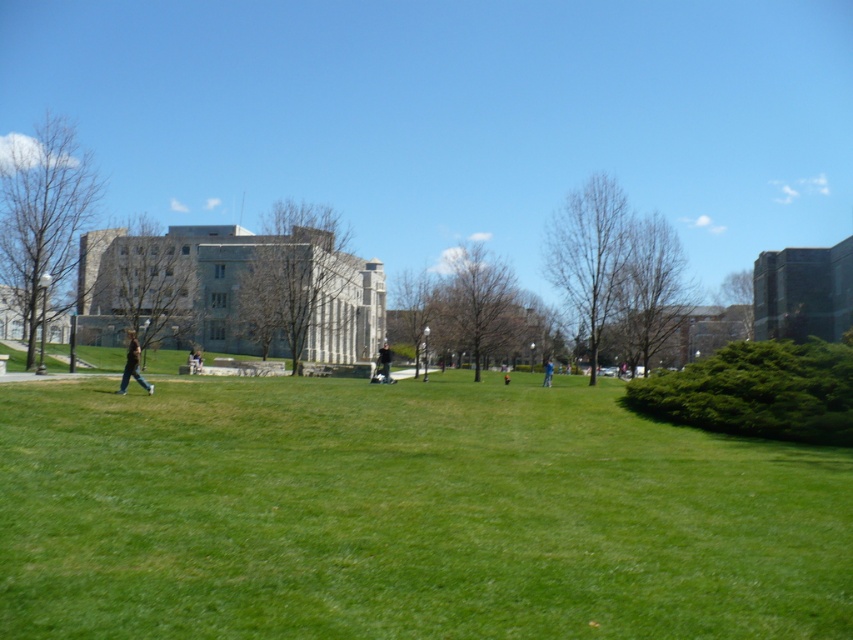
How distant is dark blue jeans at center from light brown leather jacket at center?

dark blue jeans at center is 12.06 meters from light brown leather jacket at center.

Does dark blue jeans at center have a larger size compared to light brown leather jacket at center?

Indeed, dark blue jeans at center has a larger size compared to light brown leather jacket at center.

Locate an element on the screen. This screenshot has height=640, width=853. dark blue jeans at center is located at coordinates (384, 360).

Locate an element on the screen. This screenshot has height=640, width=853. dark blue jeans at center is located at coordinates (384, 360).

Is dark blue jeans at center closer to camera compared to blue fabric person at center?

Yes, dark blue jeans at center is closer to the viewer.

Can you confirm if dark blue jeans at center is positioned to the right of blue fabric person at center?

No, dark blue jeans at center is not to the right of blue fabric person at center.

The image size is (853, 640). Describe the element at coordinates (384, 360) in the screenshot. I see `dark blue jeans at center` at that location.

Locate an element on the screen. dark blue jeans at center is located at coordinates (384, 360).

Does light brown leather jacket at left have a greater width compared to light brown leather jacket at center?

No.

Which is below, light brown leather jacket at left or light brown leather jacket at center?

Positioned lower is light brown leather jacket at center.

Which is in front, point (142, 387) or point (187, 364)?

Positioned in front is point (142, 387).

I want to click on light brown leather jacket at left, so click(x=132, y=365).